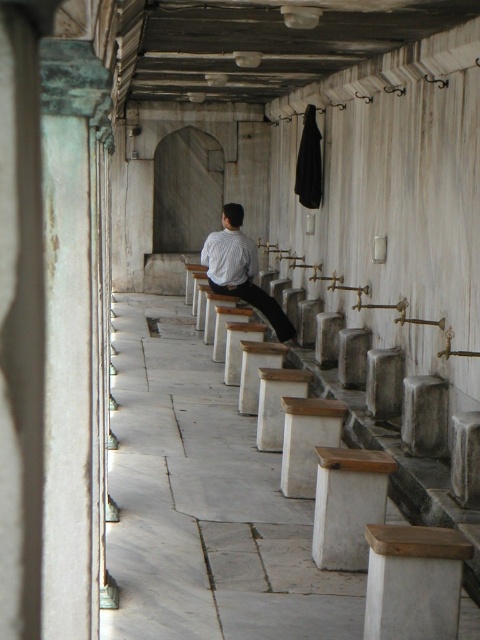
Question: Is white marble bench at center behind white striped shirt at center?

Choices:
 (A) no
 (B) yes

Answer: (A)

Question: Which point is closer to the camera?

Choices:
 (A) white striped shirt at center
 (B) white marble bench at center

Answer: (B)

Question: From the image, what is the correct spatial relationship of white marble bench at center in relation to white striped shirt at center?

Choices:
 (A) below
 (B) above

Answer: (A)

Question: Does white marble bench at center have a smaller size compared to white striped shirt at center?

Choices:
 (A) yes
 (B) no

Answer: (B)